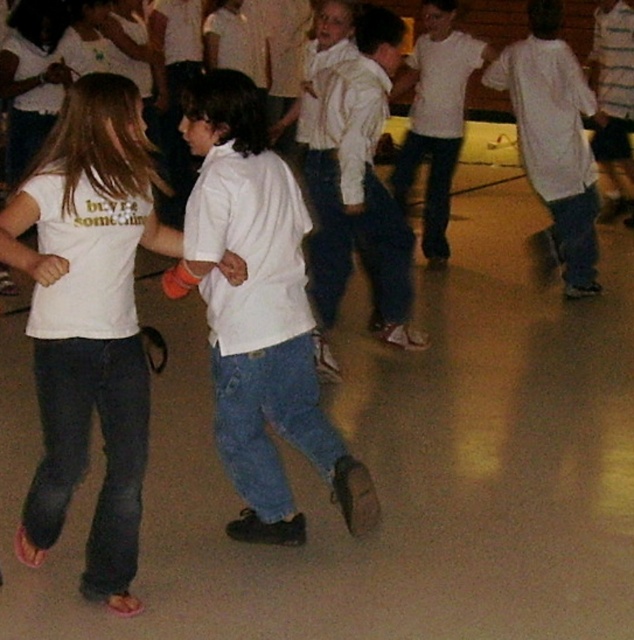
Question: Which is farther from the white matte shirt at center?

Choices:
 (A) white cotton shirt at right
 (B) white cotton shirt at center

Answer: (A)

Question: Which point is farther to the camera?

Choices:
 (A) white cotton t-shirt at center
 (B) white cotton shirt at center
 (C) white matte shirt at center
 (D) white cotton shirt at right

Answer: (D)

Question: Where is white cotton t-shirt at center located in relation to white cotton shirt at right in the image?

Choices:
 (A) right
 (B) left

Answer: (B)

Question: Estimate the real-world distances between objects in this image. Which object is farther from the white cotton t-shirt at center?

Choices:
 (A) white cotton shirt at right
 (B) white cotton shirt at center

Answer: (A)

Question: Is white cotton t-shirt at center to the left of white cotton shirt at right from the viewer's perspective?

Choices:
 (A) no
 (B) yes

Answer: (B)

Question: Is white matte shirt at center in front of white cotton shirt at center?

Choices:
 (A) no
 (B) yes

Answer: (B)